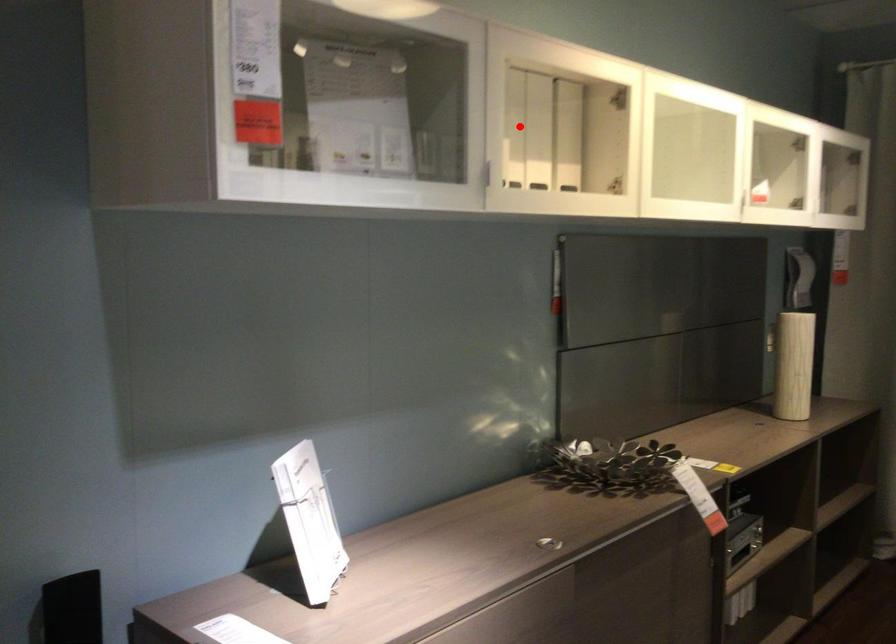
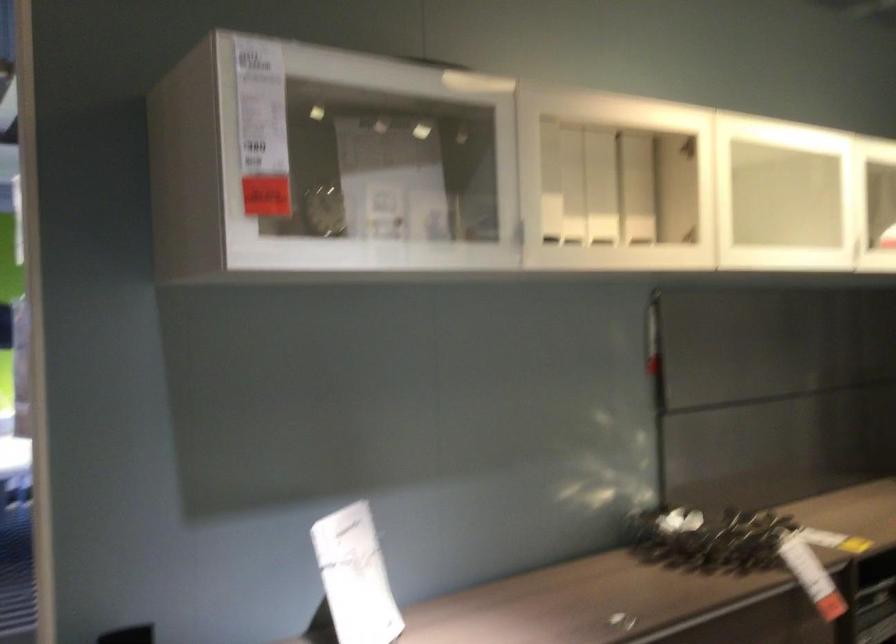
Where in the second image is the point corresponding to the highlighted location from the first image?

(573, 184)